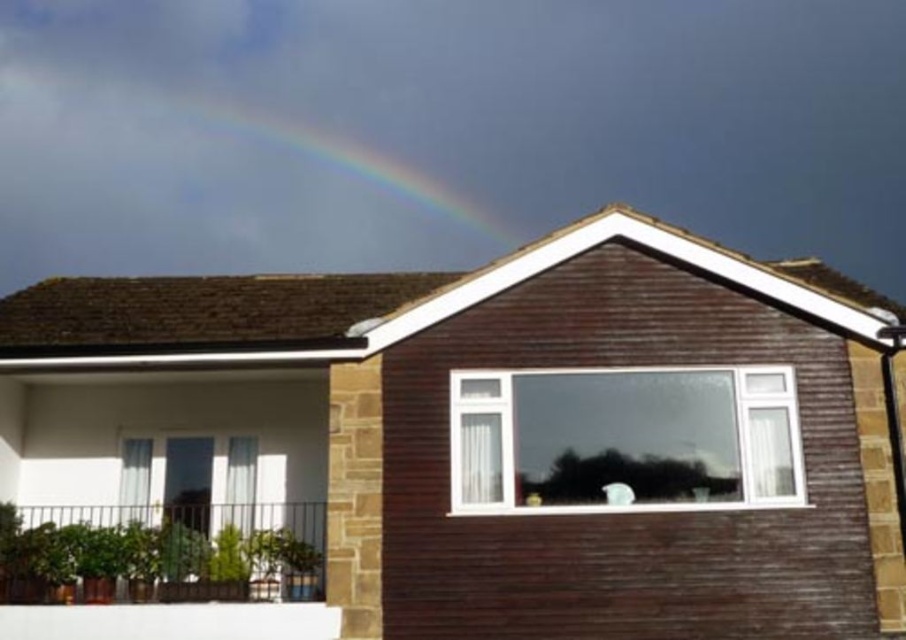
Question: Among these points, which one is farthest from the camera?

Choices:
 (A) (417, 152)
 (B) (571, 371)

Answer: (A)

Question: Which object is farther from the camera taking this photo?

Choices:
 (A) rainbow at upper center
 (B) clear glass window at center

Answer: (A)

Question: Is clear glass window at center in front of rainbow at upper center?

Choices:
 (A) no
 (B) yes

Answer: (B)

Question: Is the position of clear glass window at center more distant than that of rainbow at upper center?

Choices:
 (A) no
 (B) yes

Answer: (A)

Question: Which point is farther to the camera?

Choices:
 (A) (759, 497)
 (B) (343, 120)

Answer: (B)

Question: Does clear glass window at center appear on the left side of rainbow at upper center?

Choices:
 (A) yes
 (B) no

Answer: (B)